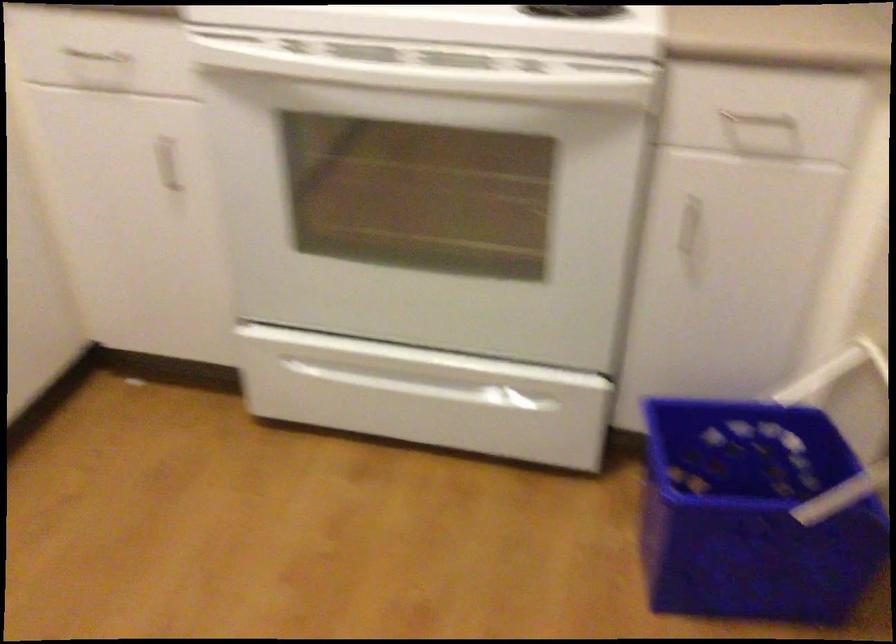
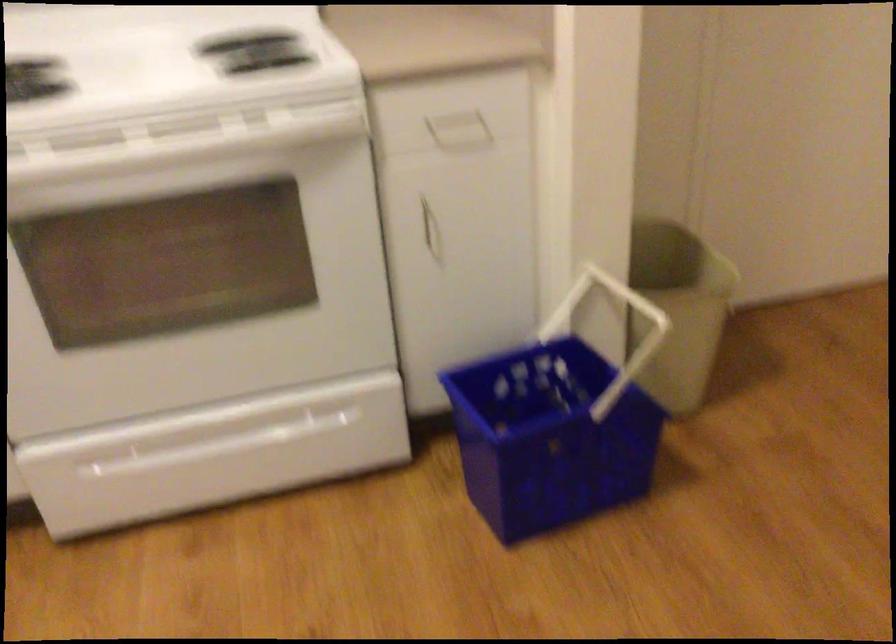
Question: The camera is either moving clockwise (left) or counter-clockwise (right) around the object. The first image is from the beginning of the video and the second image is from the end. Is the camera moving left or right when shooting the video?

Choices:
 (A) Left
 (B) Right

Answer: (A)